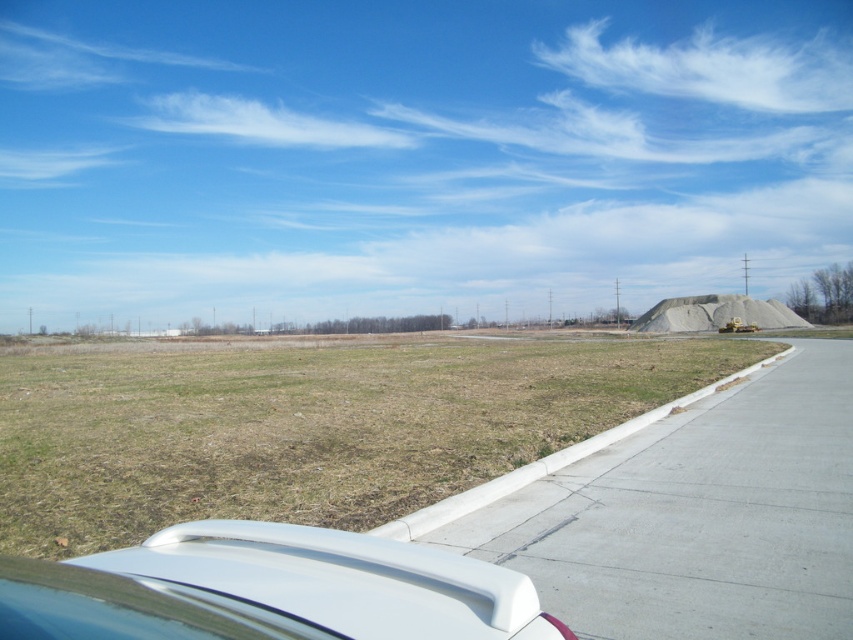
You are a driver sitting in the front passenger seat of the white vehicle. You want to reach the white matte spoiler at lower center to check its condition. Can you comfortably reach it from your seat without leaving the vehicle?

The white matte spoiler at lower center is 1.20 meters away from the viewer, so yes, you can comfortably reach it from the front passenger seat since the distance is manageable within the vehicle.

You are a driver looking out the side window of the car. You see the green grass at lower left and the white matte spoiler at lower center. Which object is closer to you?

The green grass at lower left is closer to you because it is bigger than the white matte spoiler at lower center, and in perspective, larger objects appear closer.